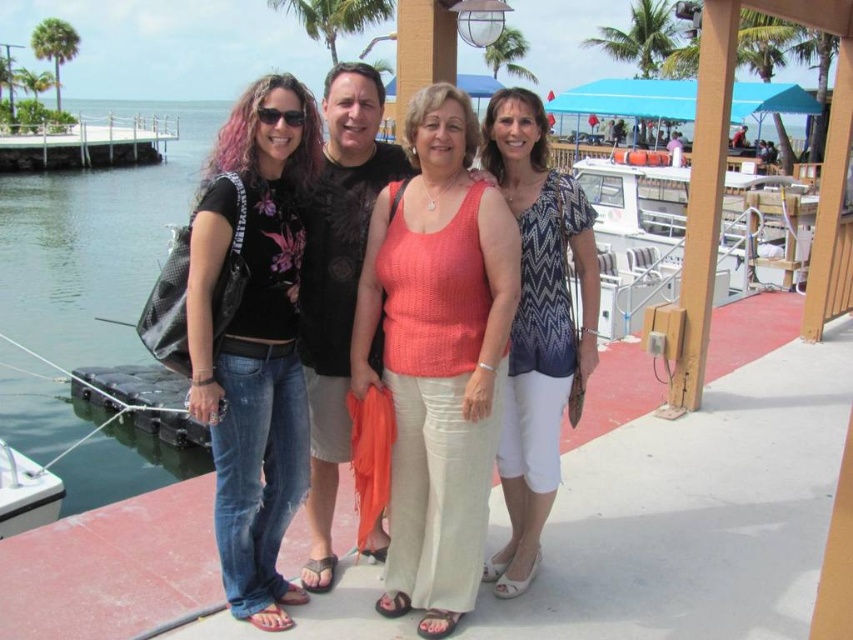
Is denim jeans at left thinner than patterned fabric blouse at center?

No.

Does point (256, 333) lie behind point (514, 136)?

That is False.

Between point (283, 77) and point (524, 269), which one is positioned behind?

Positioned behind is point (524, 269).

Find the location of a particular element. denim jeans at left is located at coordinates (254, 339).

Is denim jeans at left bigger than transparent plastic water at left?

Actually, denim jeans at left might be smaller than transparent plastic water at left.

Does denim jeans at left have a smaller size compared to transparent plastic water at left?

Correct, denim jeans at left occupies less space than transparent plastic water at left.

The width and height of the screenshot is (853, 640). In order to click on denim jeans at left in this screenshot , I will do `click(254, 339)`.

Is matte black shirt at center to the left of white matte boat at lower left from the viewer's perspective?

Incorrect, matte black shirt at center is not on the left side of white matte boat at lower left.

Image resolution: width=853 pixels, height=640 pixels. What do you see at coordinates (437, 355) in the screenshot? I see `matte black shirt at center` at bounding box center [437, 355].

In order to click on matte black shirt at center in this screenshot , I will do `click(437, 355)`.